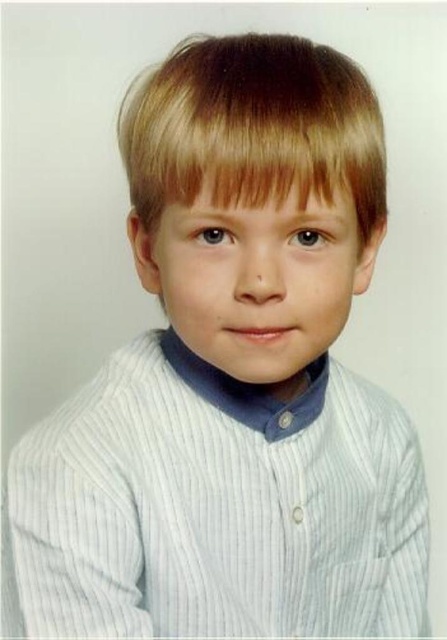
Question: Does blonde silky hair at upper center appear over smooth skin face at center?

Choices:
 (A) yes
 (B) no

Answer: (A)

Question: Which object is farther from the camera taking this photo?

Choices:
 (A) blonde silky hair at upper center
 (B) smooth skin face at center

Answer: (B)

Question: Does blonde silky hair at upper center have a smaller size compared to smooth skin face at center?

Choices:
 (A) no
 (B) yes

Answer: (A)

Question: From the image, what is the correct spatial relationship of blonde silky hair at upper center in relation to smooth skin face at center?

Choices:
 (A) right
 (B) left

Answer: (B)

Question: Which point is farther to the camera?

Choices:
 (A) (245, 333)
 (B) (118, 128)

Answer: (B)